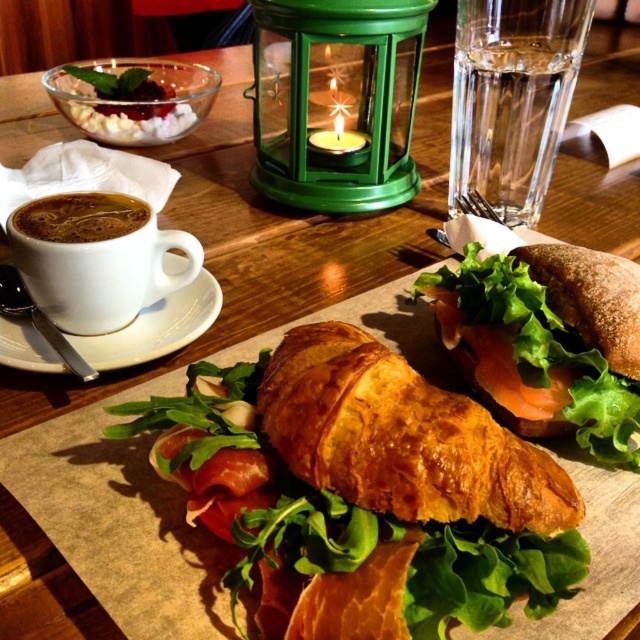
You are setting up a breakfast tray and need to place the white ceramic cup at upper left and the brown matte cup of coffee at upper left. If the tray has limited space, which cup should you place first to ensure both fit?

The white ceramic cup at upper left might be wider than the brown matte cup of coffee at upper left, so you should place the wider white ceramic cup at upper left first to ensure both fit on the tray.

Looking at this image, you are a person sitting at the table in the image. You want to reach for the point closer to you between point (145, 346) and point (118, 227). Which point should you reach for?

You should reach for point (145, 346) because it is closer to you than point (118, 227).

You are arranging a brunch table and want to place a decorative vase between the golden brown flaky croissant at center and the brown crusty sandwich at center. Based on their widths, which object should the vase be closer to?

The golden brown flaky croissant at center is wider than the brown crusty sandwich at center. Therefore, the vase should be placed closer to the brown crusty sandwich at center to balance the widths of the two objects.